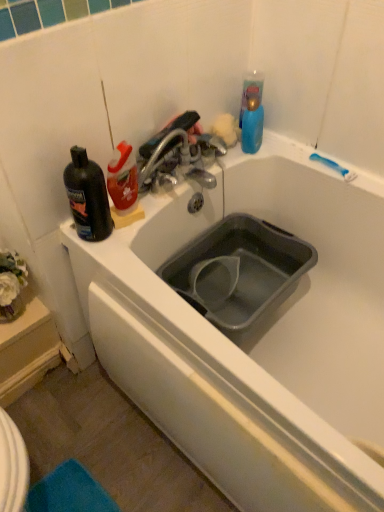
The image size is (384, 512). I want to click on white matte bathtub at center, so click(259, 340).

Describe the element at coordinates (87, 197) in the screenshot. The width and height of the screenshot is (384, 512). I see `black plastic bottle at upper left` at that location.

The width and height of the screenshot is (384, 512). In order to click on gray plastic sink at center in this screenshot , I will do `click(239, 271)`.

Is black plastic bottle at upper left located within metallic silver faucet at upper center?

No.

Considering the sizes of objects metallic silver faucet at upper center and black plastic bottle at upper left in the image provided, who is thinner, metallic silver faucet at upper center or black plastic bottle at upper left?

With smaller width is metallic silver faucet at upper center.

Identify the location of bottle lying on the left of metallic silver faucet at upper center. The image size is (384, 512). (87, 197).

Can you tell me how much metallic silver faucet at upper center and black plastic bottle at upper left differ in facing direction?

0.00146 degrees separate the facing orientations of metallic silver faucet at upper center and black plastic bottle at upper left.

At what (x,y) coordinates should I click in order to perform the action: click on bathtub below the metallic silver faucet at upper center (from a real-world perspective). Please return your answer as a coordinate pair (x, y). The width and height of the screenshot is (384, 512). Looking at the image, I should click on (259, 340).

Based on the photo, is metallic silver faucet at upper center shorter than white matte bathtub at center?

Incorrect, the height of metallic silver faucet at upper center does not fall short of that of white matte bathtub at center.

From a real-world perspective, who is located higher, metallic silver faucet at upper center or white matte bathtub at center?

metallic silver faucet at upper center.

Between black plastic bottle at upper left and white matte bathtub at center, which one has smaller width?

black plastic bottle at upper left is thinner.

Which object is further away from the camera taking this photo, black plastic bottle at upper left or white matte bathtub at center?

black plastic bottle at upper left.

From the image's perspective, does black plastic bottle at upper left appear lower than white matte bathtub at center?

Actually, black plastic bottle at upper left appears above white matte bathtub at center in the image.

Is gray plastic sink at center facing away from white matte bathtub at center?

No, white matte bathtub at center is not at the back of gray plastic sink at center.

How much distance is there between gray plastic sink at center and white matte bathtub at center?

The distance of gray plastic sink at center from white matte bathtub at center is 6.49 inches.

Based on the photo, which is less distant, (202,251) or (128,373)?

Point (202,251) is farther from the camera than point (128,373).

In the image, is gray plastic sink at center positioned in front of or behind white matte bathtub at center?

gray plastic sink at center is positioned farther from the viewer than white matte bathtub at center.

Considering the sizes of white matte bathtub at center and metallic silver faucet at upper center in the image, is white matte bathtub at center bigger or smaller than metallic silver faucet at upper center?

Considering their sizes, white matte bathtub at center takes up more space than metallic silver faucet at upper center.

Does white matte bathtub at center contain metallic silver faucet at upper center?

Definitely not — metallic silver faucet at upper center is not inside white matte bathtub at center.

Which is more to the left, white matte bathtub at center or metallic silver faucet at upper center?

From the viewer's perspective, metallic silver faucet at upper center appears more on the left side.

In terms of width, does black plastic bottle at upper left look wider or thinner when compared to metallic silver faucet at upper center?

Considering their sizes, black plastic bottle at upper left looks broader than metallic silver faucet at upper center.

How far apart are black plastic bottle at upper left and metallic silver faucet at upper center?

black plastic bottle at upper left is 8.32 inches from metallic silver faucet at upper center.

Is black plastic bottle at upper left oriented towards metallic silver faucet at upper center?

No, black plastic bottle at upper left is not oriented towards metallic silver faucet at upper center.

From the image's perspective, does black plastic bottle at upper left appear lower than metallic silver faucet at upper center?

A: Indeed, from the image's perspective, black plastic bottle at upper left is shown beneath metallic silver faucet at upper center.

From the image's perspective, would you say white matte bathtub at center is positioned over gray plastic sink at center?

Actually, white matte bathtub at center appears below gray plastic sink at center in the image.

Who is bigger, white matte bathtub at center or gray plastic sink at center?

With larger size is white matte bathtub at center.

Which of these two, white matte bathtub at center or gray plastic sink at center, stands shorter?

white matte bathtub at center.

Where is `tap above the black plastic bottle at upper left (from the image's perspective)`? This screenshot has width=384, height=512. tap above the black plastic bottle at upper left (from the image's perspective) is located at coordinates (174, 164).

I want to click on tap that appears behind the white matte bathtub at center, so click(174, 164).

From the image, which object appears to be nearer to metallic silver faucet at upper center, black plastic bottle at upper left or gray plastic sink at center?

Based on the image, black plastic bottle at upper left appears to be nearer to metallic silver faucet at upper center.

Consider the image. When comparing their distances from black plastic bottle at upper left, does gray plastic sink at center or white matte bathtub at center seem further?

white matte bathtub at center.

Looking at the image, which one is located further to black plastic bottle at upper left, white matte bathtub at center or metallic silver faucet at upper center?

The object further to black plastic bottle at upper left is white matte bathtub at center.

Considering their positions, is metallic silver faucet at upper center positioned further to gray plastic sink at center than white matte bathtub at center?

The object further to gray plastic sink at center is metallic silver faucet at upper center.

Looking at the image, which one is located closer to gray plastic sink at center, black plastic bottle at upper left or white matte bathtub at center?

white matte bathtub at center is closer to gray plastic sink at center.

Based on their spatial positions, is gray plastic sink at center or metallic silver faucet at upper center further from black plastic bottle at upper left?

gray plastic sink at center is further to black plastic bottle at upper left.

Based on their spatial positions, is black plastic bottle at upper left or metallic silver faucet at upper center further from gray plastic sink at center?

black plastic bottle at upper left is further to gray plastic sink at center.

Based on the photo, looking at the image, which one is located further to white matte bathtub at center, black plastic bottle at upper left or metallic silver faucet at upper center?

black plastic bottle at upper left is positioned further to the anchor white matte bathtub at center.

You are a GUI agent. You are given a task and a screenshot of the screen. Output one action in this format:
    pyautogui.click(x=<x>, y=<y>)
    Task: Click on the sink between metallic silver faucet at upper center and white matte bathtub at center from top to bottom
    The width and height of the screenshot is (384, 512).
    Given the screenshot: What is the action you would take?
    pyautogui.click(x=239, y=271)

Where is `tap situated between black plastic bottle at upper left and gray plastic sink at center from left to right`? Image resolution: width=384 pixels, height=512 pixels. tap situated between black plastic bottle at upper left and gray plastic sink at center from left to right is located at coordinates (174, 164).

Where is `sink that lies between black plastic bottle at upper left and white matte bathtub at center from top to bottom`? sink that lies between black plastic bottle at upper left and white matte bathtub at center from top to bottom is located at coordinates (239, 271).

Where is `bottle that lies between metallic silver faucet at upper center and white matte bathtub at center from top to bottom`? The height and width of the screenshot is (512, 384). bottle that lies between metallic silver faucet at upper center and white matte bathtub at center from top to bottom is located at coordinates (87, 197).